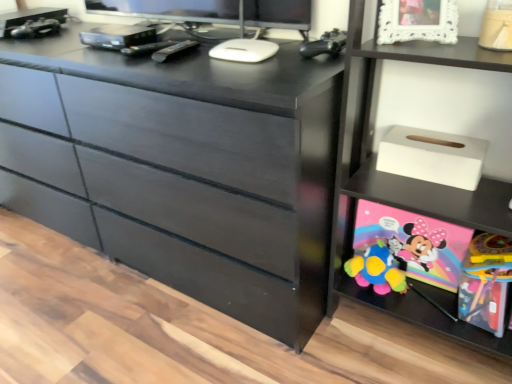
Question: Should I look upward or downward to see white lace picture frame at upper right?

Choices:
 (A) up
 (B) down

Answer: (A)

Question: Does matte black dresser at center lie in front of white matte tissue box at upper right?

Choices:
 (A) no
 (B) yes

Answer: (B)

Question: Considering the relative positions of matte black dresser at center and white matte tissue box at upper right in the image provided, is matte black dresser at center to the right of white matte tissue box at upper right from the viewer's perspective?

Choices:
 (A) yes
 (B) no

Answer: (B)

Question: Are matte black dresser at center and white matte tissue box at upper right far apart?

Choices:
 (A) yes
 (B) no

Answer: (B)

Question: Does matte black dresser at center contain white matte tissue box at upper right?

Choices:
 (A) yes
 (B) no

Answer: (B)

Question: Is matte black dresser at center looking in the opposite direction of white matte tissue box at upper right?

Choices:
 (A) yes
 (B) no

Answer: (B)

Question: From the image's perspective, is matte black dresser at center beneath white matte tissue box at upper right?

Choices:
 (A) no
 (B) yes

Answer: (A)

Question: Considering the relative sizes of black matte controller at upper right, the second toy from the bottom, and black plastic remote at center in the image provided, is black matte controller at upper right, the second toy from the bottom, shorter than black plastic remote at center?

Choices:
 (A) no
 (B) yes

Answer: (A)

Question: Considering the relative sizes of black matte controller at upper right, which is the first toy from top to bottom, and black plastic remote at center in the image provided, is black matte controller at upper right, which is the first toy from top to bottom, thinner than black plastic remote at center?

Choices:
 (A) no
 (B) yes

Answer: (B)

Question: Can you confirm if black matte controller at upper right, the second toy from the bottom, is wider than black plastic remote at center?

Choices:
 (A) yes
 (B) no

Answer: (B)

Question: Is black matte controller at upper right, the first toy viewed from the left, aimed at black plastic remote at center?

Choices:
 (A) no
 (B) yes

Answer: (A)

Question: Is black matte controller at upper right, the first toy viewed from the left, bigger than black plastic remote at center?

Choices:
 (A) no
 (B) yes

Answer: (B)

Question: Is black matte controller at upper right, the second toy from the bottom, turned away from black plastic remote at center?

Choices:
 (A) yes
 (B) no

Answer: (B)

Question: Can you confirm if black plastic remote at center is wider than white matte tissue box at upper right?

Choices:
 (A) yes
 (B) no

Answer: (A)